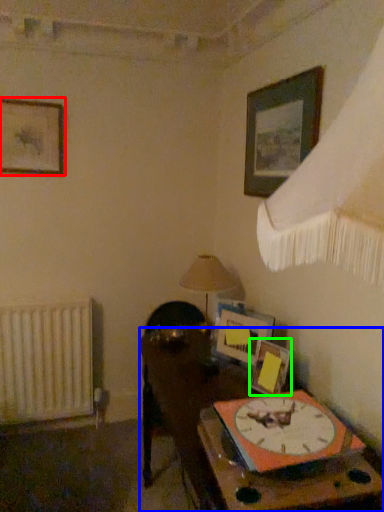
Question: Considering the real-world distances, which object is closest to picture frame (highlighted by a red box)? table (highlighted by a blue box) or picture frame (highlighted by a green box).

Choices:
 (A) table
 (B) picture frame

Answer: (A)